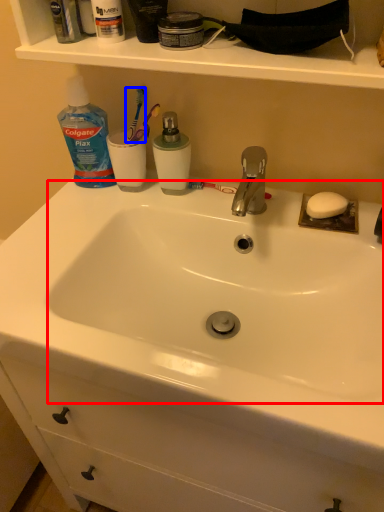
Question: Which point is closer to the camera, sink (highlighted by a red box) or toothbrush (highlighted by a blue box)?

Choices:
 (A) sink
 (B) toothbrush

Answer: (A)